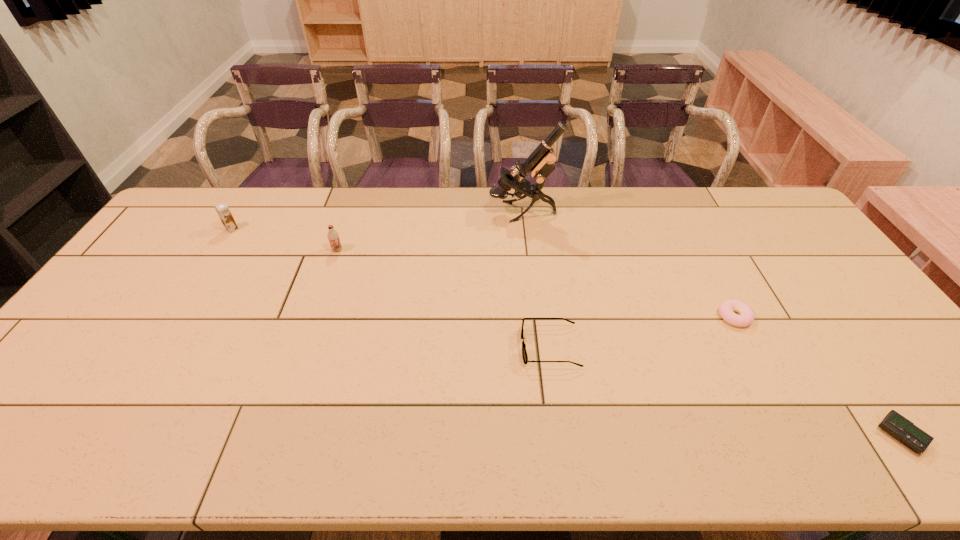
In the image, there is a desktop. In order to click on vacant space at the near right corner in this screenshot , I will do `click(950, 433)`.

You are a GUI agent. You are given a task and a screenshot of the screen. Output one action in this format:
    pyautogui.click(x=<x>, y=<y>)
    Task: Click on the free point between the third shortest object and the fifth object from right to left
    
    Given the screenshot: What is the action you would take?
    pyautogui.click(x=444, y=299)

Locate an element on the screen. This screenshot has height=540, width=960. empty location between the nearest object and the farther chocolate milk is located at coordinates (566, 332).

This screenshot has width=960, height=540. What are the coordinates of `vacant point located between the third shortest object and the tallest object` in the screenshot? It's located at [x=536, y=279].

Locate an element on the screen. The image size is (960, 540). free area in between the third shortest object and the farthest object is located at coordinates (536, 279).

The width and height of the screenshot is (960, 540). Identify the location of vacant space in between the second object from left to right and the tallest object. (430, 231).

This screenshot has width=960, height=540. Identify the location of vacant point located between the spectacles and the fifth object from left to right. (642, 332).

The width and height of the screenshot is (960, 540). Find the location of `vacant region between the right chocolate milk and the third shortest object`. vacant region between the right chocolate milk and the third shortest object is located at coordinates (444, 299).

Find the location of `empty space that is in between the leftmost object and the nearer chocolate milk`. empty space that is in between the leftmost object and the nearer chocolate milk is located at coordinates point(285,240).

Locate an element on the screen. free space between the fifth nearest object and the third farthest object is located at coordinates (285, 240).